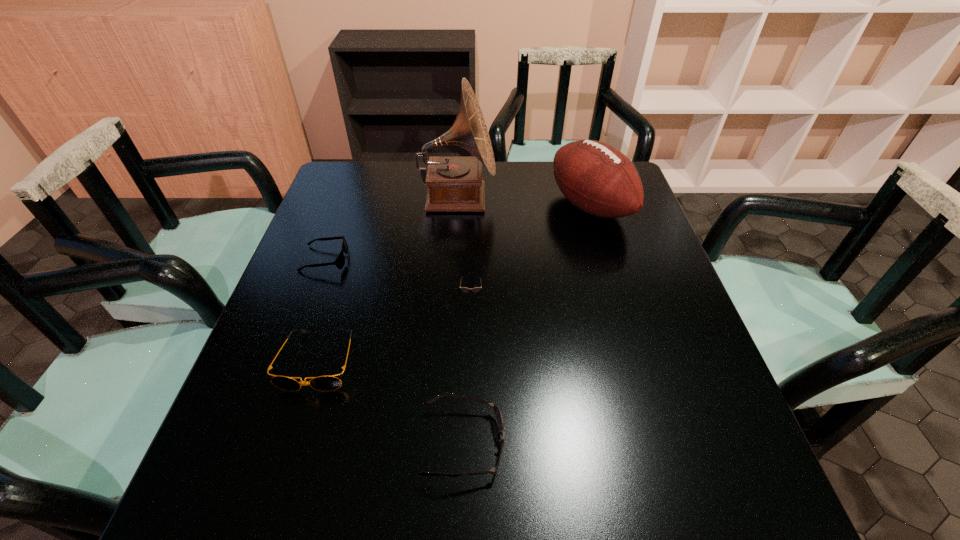
The height and width of the screenshot is (540, 960). Find the location of `vacant point that satisfies the following two spatial constraints: 1. on the horn of the tallest object; 2. on the back side of the rightmost object`. vacant point that satisfies the following two spatial constraints: 1. on the horn of the tallest object; 2. on the back side of the rightmost object is located at coordinates (457, 206).